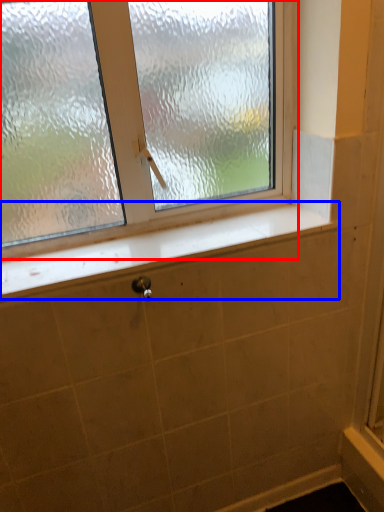
Question: Among these objects, which one is farthest to the camera, window (highlighted by a red box) or window sill (highlighted by a blue box)?

Choices:
 (A) window
 (B) window sill

Answer: (B)